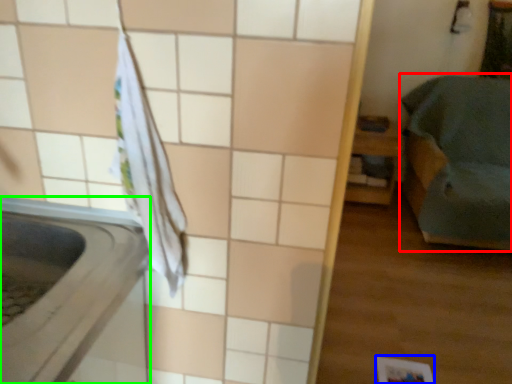
Question: Estimate the real-world distances between objects in this image. Which object is closer to furniture (highlighted by a red box), square (highlighted by a blue box) or appliance (highlighted by a green box)?

Choices:
 (A) square
 (B) appliance

Answer: (A)